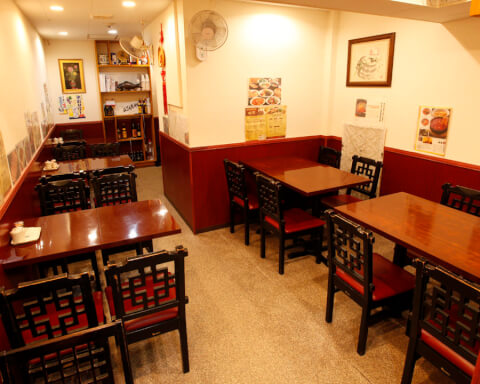
You are a GUI agent. You are given a task and a screenshot of the screen. Output one action in this format:
    pyautogui.click(x=<x>, y=<y>)
    Task: Click on the floor
    This screenshot has width=480, height=384.
    Given the screenshot: What is the action you would take?
    pyautogui.click(x=290, y=340)